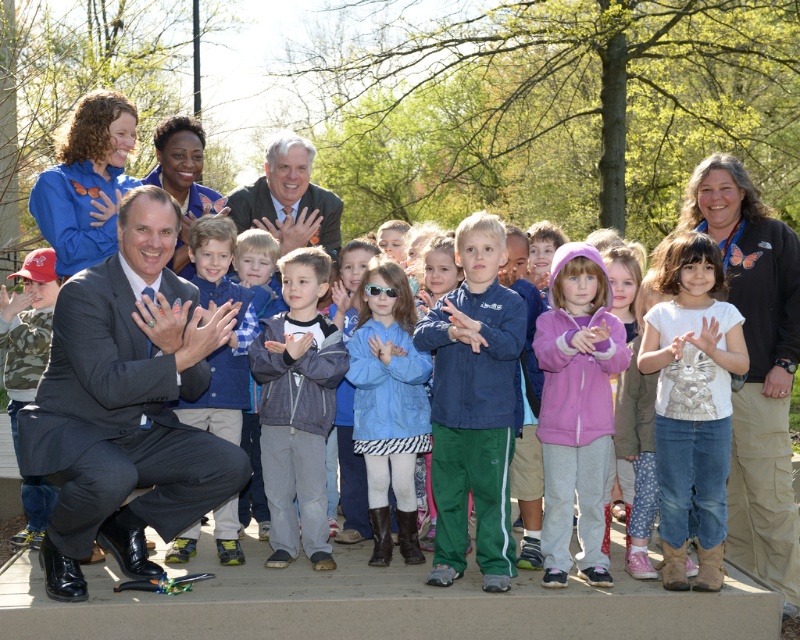
What is located at the coordinates point (388, 404) in the image?

The blue matte jacket at center is located at point (388, 404).

You are a photographer trying to capture a group photo of the purple fleece jacket at center and the gray fleece jacket at center. Which jacket should you focus on first if you want to ensure both are in focus, considering their heights?

The purple fleece jacket at center is much taller than the gray fleece jacket at center, so you should focus on the purple fleece jacket at center first to ensure both are in focus.